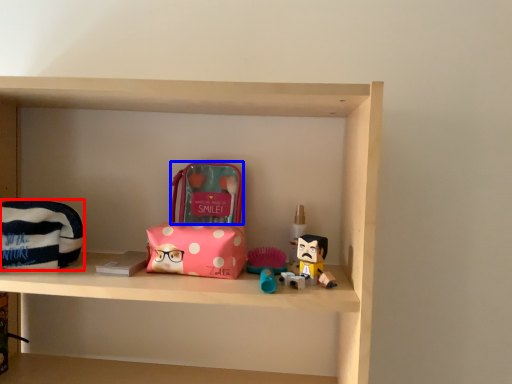
Question: Among these objects, which one is nearest to the camera, pouch (highlighted by a red box) or pouch (highlighted by a blue box)?

Choices:
 (A) pouch
 (B) pouch

Answer: (A)